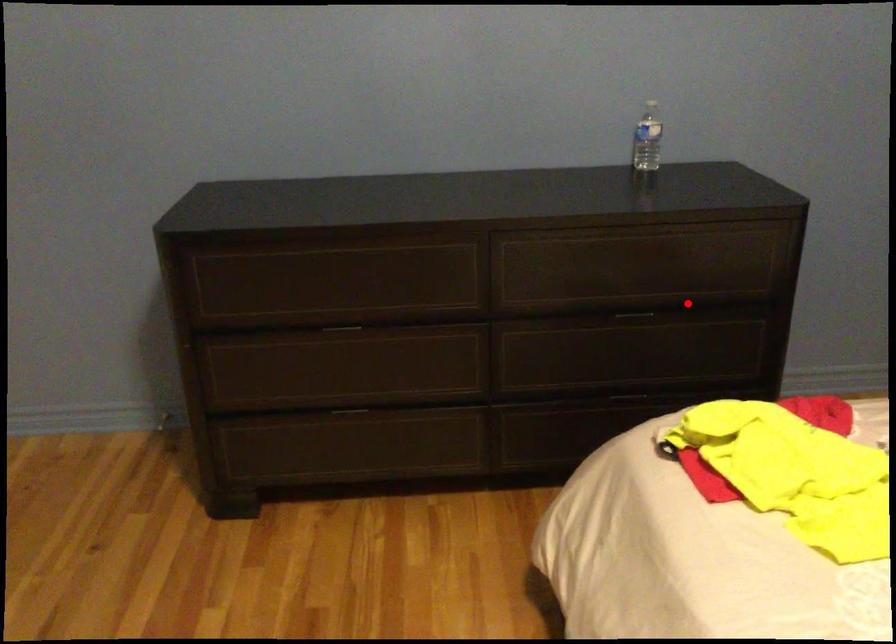
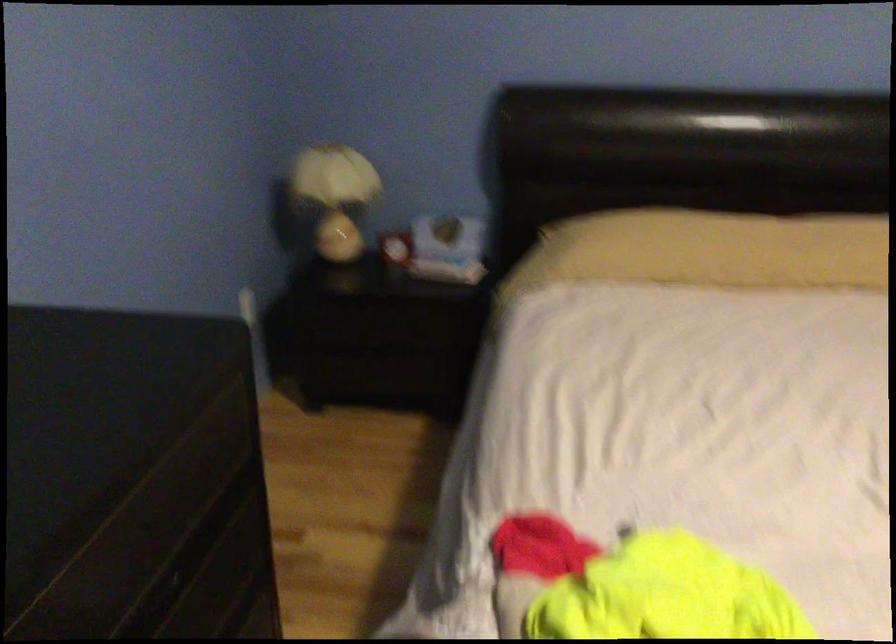
Question: A red point is marked in image1. In image2, is the corresponding 3D point closer to the camera or farther? Reply with the corresponding letter.

Choices:
 (A) The corresponding 3D point is closer.
 (B) The corresponding 3D point is farther.

Answer: (A)